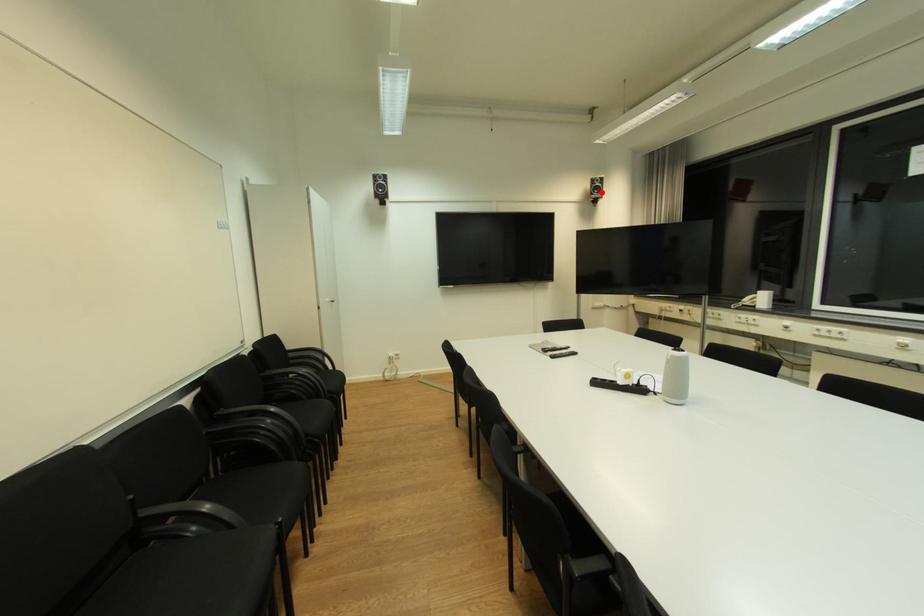
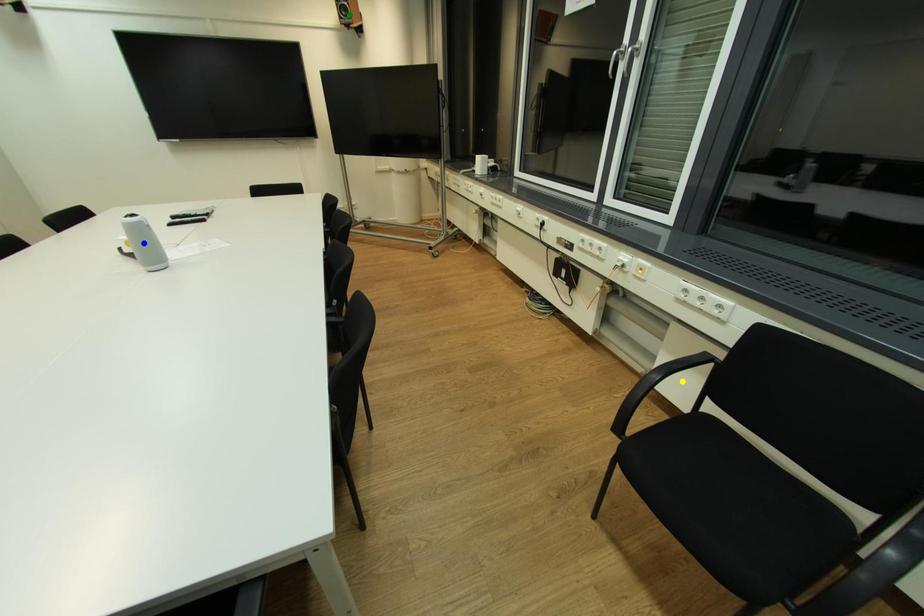
Question: I am providing you with two images of the same scene from different viewpoints. A red point is marked on the first image. You are given multiple points on the second image. In image 2, which mark is for the same physical point as the one in image 1?

Choices:
 (A) yellow point
 (B) blue point
 (C) green point

Answer: (C)